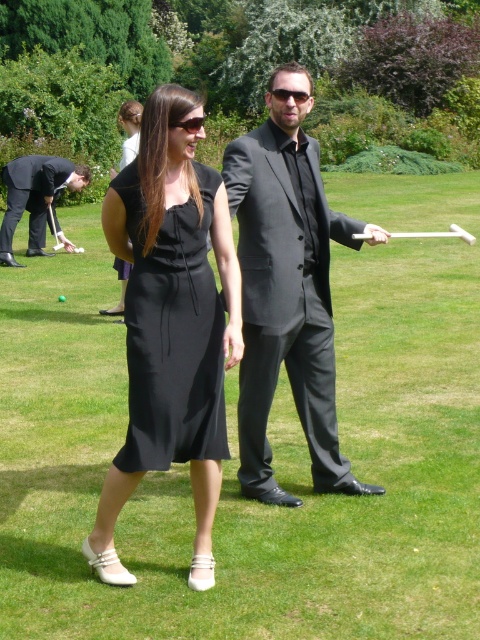
Where is the black satin dress at center located in the image?

The black satin dress at center is located at point coordinates of (170, 323).

You are planning to take a photo of the satin black dress at center and the black suit at left for a fashion magazine. Since you want both outfits to appear equally prominent in the photo, which adjustment should you make based on their sizes?

The satin black dress at center is smaller in width than the black suit at left. To make them appear equally prominent, you should position the satin black dress at center closer to the camera or move the black suit at left farther away to balance their sizes in the frame.